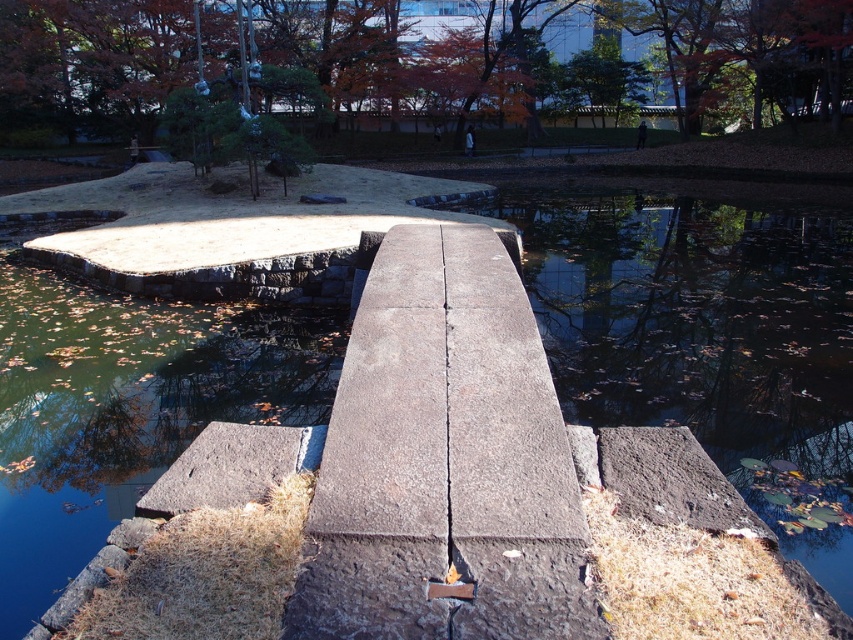
You are standing at the stone bridge in the park and looking towards the water. There are two points marked on the bridge walkway at coordinates point (462,605) and point (494,26). If you want to place a small decorative rock on the bridge walkway, which point should you choose to ensure it is closer to your current position?

You should place the small decorative rock at point (462,605) because it is closer to your current position than point (494,26).

You are standing at the origin point of the park scene and want to sit on the gray concrete bench at center. Which direction should you walk to reach it?

The gray concrete bench at center is located at coordinates point (444,460), so you should walk towards the center of the scene to reach it.